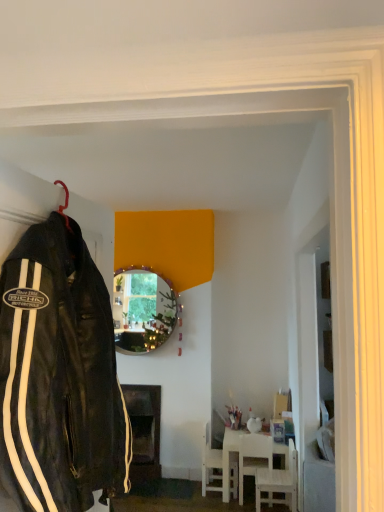
Question: Can you confirm if shiny gold mirror at center is wider than white wood chair at lower center, placed as the 2th chair when sorted from right to left?

Choices:
 (A) yes
 (B) no

Answer: (B)

Question: Does shiny gold mirror at center appear on the right side of white wood chair at lower center, acting as the second chair starting from the left?

Choices:
 (A) yes
 (B) no

Answer: (B)

Question: Is white wood chair at lower center, acting as the second chair starting from the left, completely or partially inside shiny gold mirror at center?

Choices:
 (A) no
 (B) yes

Answer: (A)

Question: Does shiny gold mirror at center have a smaller size compared to white wood chair at lower center, acting as the second chair starting from the left?

Choices:
 (A) yes
 (B) no

Answer: (B)

Question: Is shiny gold mirror at center shorter than white wood chair at lower center, placed as the 2th chair when sorted from right to left?

Choices:
 (A) yes
 (B) no

Answer: (B)

Question: From a real-world perspective, is shiny gold mirror at center located beneath white wood chair at lower center, acting as the second chair starting from the left?

Choices:
 (A) yes
 (B) no

Answer: (B)

Question: Does white wooden chair at lower right, arranged as the 3th chair when viewed from the left, have a lesser width compared to black leather jacket at left?

Choices:
 (A) yes
 (B) no

Answer: (B)

Question: Does white wooden chair at lower right, arranged as the 3th chair when viewed from the left, appear on the left side of black leather jacket at left?

Choices:
 (A) yes
 (B) no

Answer: (B)

Question: Would you consider white wooden chair at lower right, the first chair from the right, to be distant from black leather jacket at left?

Choices:
 (A) no
 (B) yes

Answer: (B)

Question: Considering the relative sizes of white wooden chair at lower right, the first chair from the right, and black leather jacket at left in the image provided, is white wooden chair at lower right, the first chair from the right, bigger than black leather jacket at left?

Choices:
 (A) no
 (B) yes

Answer: (A)

Question: Is white wooden chair at lower right, the first chair from the right, surrounding black leather jacket at left?

Choices:
 (A) no
 (B) yes

Answer: (A)

Question: Could you tell me if white wooden chair at lower right, the first chair from the right, is turned towards black leather jacket at left?

Choices:
 (A) no
 (B) yes

Answer: (A)

Question: Could you tell me if white wood chair at lower center, placed as the 2th chair when sorted from right to left, is facing black leather jacket at left?

Choices:
 (A) yes
 (B) no

Answer: (B)